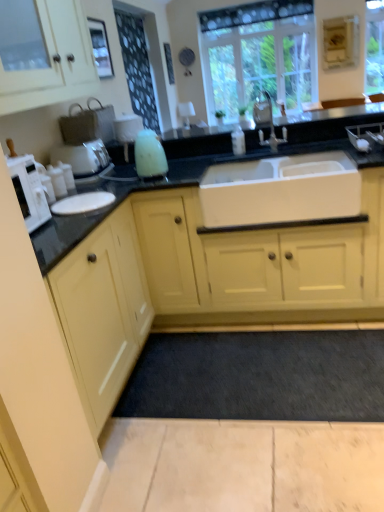
Describe the element at coordinates (29, 191) in the screenshot. I see `white matte microwave at left` at that location.

What do you see at coordinates (128, 195) in the screenshot? The height and width of the screenshot is (512, 384). I see `black granite countertop at center` at bounding box center [128, 195].

Find the location of a particular element. The image size is (384, 512). clear glass window at upper center is located at coordinates (258, 54).

The height and width of the screenshot is (512, 384). Describe the element at coordinates (103, 310) in the screenshot. I see `matte yellow cabinet at left, the 1th cabinetry in the bottom-to-top sequence` at that location.

Image resolution: width=384 pixels, height=512 pixels. Describe the element at coordinates (280, 190) in the screenshot. I see `white matte sink at center` at that location.

What are the coordinates of `white matte microwave at left` in the screenshot? It's located at (29, 191).

Considering the positions of objects white matte microwave at left and matte white cabinet at upper left, arranged as the second cabinetry when ordered from the bottom, in the image provided, who is more to the left, white matte microwave at left or matte white cabinet at upper left, arranged as the second cabinetry when ordered from the bottom,?

From the viewer's perspective, matte white cabinet at upper left, arranged as the second cabinetry when ordered from the bottom, appears more on the left side.

Considering the positions of points (46, 215) and (4, 109), is point (46, 215) closer to camera compared to point (4, 109)?

Yes, point (46, 215) is closer to viewer.

From a real-world perspective, who is located higher, white matte microwave at left or matte white cabinet at upper left, arranged as the first cabinetry when viewed from the top?

matte white cabinet at upper left, arranged as the first cabinetry when viewed from the top, is physically above.

Between white matte microwave at left and matte white cabinet at upper left, arranged as the first cabinetry when viewed from the top, which one has larger width?

matte white cabinet at upper left, arranged as the first cabinetry when viewed from the top, is wider.

Considering the points (276, 140) and (56, 219), which point is behind, point (276, 140) or point (56, 219)?

The point (276, 140) is farther.

Is silver metallic faucet at center completely or partially outside of black granite countertop at center?

Actually, silver metallic faucet at center is within black granite countertop at center.

Is silver metallic faucet at center not near black granite countertop at center?

They are positioned close to each other.

Is silver metallic faucet at center turned away from black granite countertop at center?

That's not correct — silver metallic faucet at center is not looking away from black granite countertop at center.

Is matte white coffee machine at left oriented towards matte yellow cabinet at left, the 1th cabinetry in the bottom-to-top sequence?

No, matte white coffee machine at left is not oriented towards matte yellow cabinet at left, the 1th cabinetry in the bottom-to-top sequence.

From the image's perspective, which object appears higher, matte white coffee machine at left or matte yellow cabinet at left, the 1th cabinetry in the bottom-to-top sequence?

From the image's view, matte white coffee machine at left is above.

Can you confirm if matte white coffee machine at left is bigger than matte yellow cabinet at left, the 1th cabinetry in the bottom-to-top sequence?

No.

Is matte white coffee machine at left at the right side of matte yellow cabinet at left, the 2th cabinetry when ordered from top to bottom?

In fact, matte white coffee machine at left is to the left of matte yellow cabinet at left, the 2th cabinetry when ordered from top to bottom.

How much distance is there between white matte sink at center and matte yellow cabinet at left, the 1th cabinetry in the bottom-to-top sequence?

They are 29.44 inches apart.

Is point (318, 172) positioned behind point (120, 298)?

Yes, point (318, 172) is farther from viewer.

Which cabinetry is the 1st one when counting from the left side of the white matte sink at center? Please provide its 2D coordinates.

[(103, 310)]

In the scene shown: Can you confirm if white matte sink at center is bigger than matte yellow cabinet at left, the 2th cabinetry when ordered from top to bottom?

Incorrect, white matte sink at center is not larger than matte yellow cabinet at left, the 2th cabinetry when ordered from top to bottom.

How different are the orientations of white matte sink at center and black granite countertop at center in degrees?

The facing directions of white matte sink at center and black granite countertop at center are 0.362 degrees apart.

In the scene shown: From the image's perspective, between white matte sink at center and black granite countertop at center, which one is located above?

white matte sink at center, from the image's perspective.

Is white matte sink at center facing towards black granite countertop at center?

Yes, white matte sink at center faces towards black granite countertop at center.

Does white matte sink at center have a lesser width compared to black granite countertop at center?

Yes.

From a real-world perspective, does matte white coffee machine at left stand above dark gray carpet at lower center?

Yes.

Which is closer, (66, 156) or (321, 412)?

Point (321, 412)

Does matte white coffee machine at left have a lesser height compared to dark gray carpet at lower center?

In fact, matte white coffee machine at left may be taller than dark gray carpet at lower center.

Could you tell me if matte white coffee machine at left is facing dark gray carpet at lower center?

No, matte white coffee machine at left does not turn towards dark gray carpet at lower center.

From the image's perspective, is black granite countertop at center located beneath silver metallic faucet at center?

Indeed, from the image's perspective, black granite countertop at center is shown beneath silver metallic faucet at center.

Based on the photo, does black granite countertop at center turn towards silver metallic faucet at center?

No, black granite countertop at center is not turned towards silver metallic faucet at center.

Which object is closer to the camera, black granite countertop at center or silver metallic faucet at center?

Positioned in front is black granite countertop at center.

This screenshot has width=384, height=512. What are the coordinates of `cabinetry on the left of white matte microwave at left` in the screenshot? It's located at (54, 62).

You are a GUI agent. You are given a task and a screenshot of the screen. Output one action in this format:
    pyautogui.click(x=<x>, y=<y>)
    Task: Click on the tap that is above the black granite countertop at center (from a real-world perspective)
    The height and width of the screenshot is (512, 384).
    Given the screenshot: What is the action you would take?
    [267, 121]

When comparing their distances from silver metallic faucet at center, does matte white coffee machine at left or matte yellow cabinet at left, the 1th cabinetry in the bottom-to-top sequence, seem closer?

matte white coffee machine at left.

Considering their positions, is matte white cabinet at upper left, arranged as the first cabinetry when viewed from the top, positioned closer to black granite countertop at center than clear glass window at upper center?

matte white cabinet at upper left, arranged as the first cabinetry when viewed from the top, lies closer to black granite countertop at center than the other object.

Which object lies nearer to the anchor point white matte sink at center, dark gray carpet at lower center or silver metallic faucet at center?

Based on the image, silver metallic faucet at center appears to be nearer to white matte sink at center.

Based on their spatial positions, is black granite countertop at center or white matte sink at center closer to matte yellow cabinet at left, the 1th cabinetry in the bottom-to-top sequence?

Based on the image, black granite countertop at center appears to be nearer to matte yellow cabinet at left, the 1th cabinetry in the bottom-to-top sequence.

Looking at the image, which one is located closer to silver metallic faucet at center, black granite countertop at center or matte yellow cabinet at left, the 1th cabinetry in the bottom-to-top sequence?

The object closer to silver metallic faucet at center is black granite countertop at center.

Looking at the image, which one is located closer to white matte sink at center, matte white coffee machine at left or clear glass window at upper center?

matte white coffee machine at left.

From the image, which object appears to be nearer to white matte sink at center, matte yellow cabinet at left, the 1th cabinetry in the bottom-to-top sequence, or matte white cabinet at upper left, arranged as the first cabinetry when viewed from the top?

matte yellow cabinet at left, the 1th cabinetry in the bottom-to-top sequence.

Considering their positions, is white matte microwave at left positioned closer to black granite countertop at center than white matte sink at center?

The object closer to black granite countertop at center is white matte sink at center.

Where is `countertop between matte white cabinet at upper left, arranged as the first cabinetry when viewed from the top, and dark gray carpet at lower center in the up-down direction`? This screenshot has height=512, width=384. countertop between matte white cabinet at upper left, arranged as the first cabinetry when viewed from the top, and dark gray carpet at lower center in the up-down direction is located at coordinates (128, 195).

Locate an element on the screen. The image size is (384, 512). coffee machine positioned between dark gray carpet at lower center and clear glass window at upper center from near to far is located at coordinates (85, 139).

You are a GUI agent. You are given a task and a screenshot of the screen. Output one action in this format:
    pyautogui.click(x=<x>, y=<y>)
    Task: Click on the microwave positioned between matte white cabinet at upper left, arranged as the second cabinetry when ordered from the bottom, and matte white coffee machine at left from near to far
    This screenshot has height=512, width=384.
    Given the screenshot: What is the action you would take?
    pyautogui.click(x=29, y=191)

Locate an element on the screen. sink between black granite countertop at center and clear glass window at upper center along the z-axis is located at coordinates (280, 190).